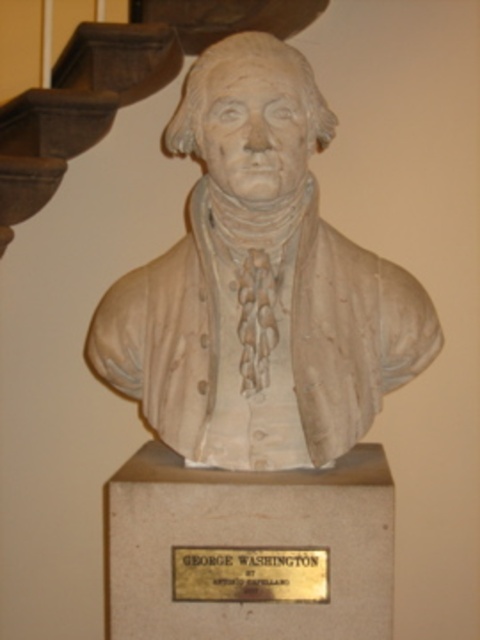
Question: Among these objects, which one is farthest from the camera?

Choices:
 (A) white marble bust at center
 (B) dark brown wood at upper left

Answer: (B)

Question: Among these objects, which one is farthest from the camera?

Choices:
 (A) white marble bust at center
 (B) gold metallic plaque at center

Answer: (A)

Question: Does white marble bust at center appear under gold metallic plaque at center?

Choices:
 (A) no
 (B) yes

Answer: (A)

Question: Can you confirm if dark brown wood at upper left is positioned below gold metallic plaque at center?

Choices:
 (A) no
 (B) yes

Answer: (A)

Question: Which of these objects is positioned closest to the white marble bust at center?

Choices:
 (A) gold metallic plaque at center
 (B) dark brown wood at upper left

Answer: (A)

Question: Observing the image, what is the correct spatial positioning of white marble bust at center in reference to gold metallic plaque at center?

Choices:
 (A) left
 (B) right

Answer: (B)